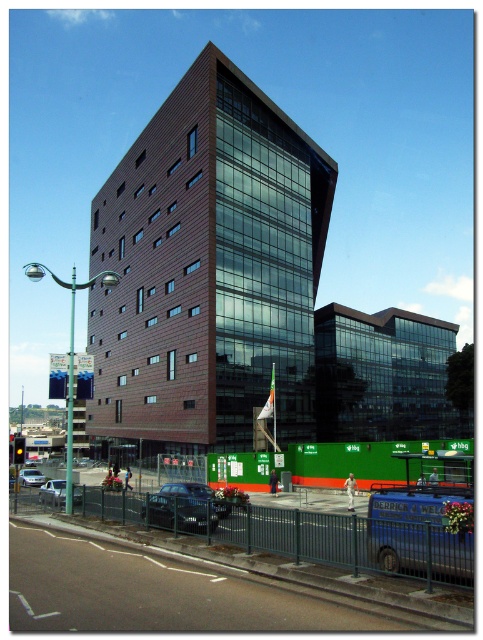
You are a delivery driver who needs to park your truck, which is 100 feet long, between the shiny black car at center and the silver metallic car at center. Is there enough space between them to park your truck?

The distance between the shiny black car at center and the silver metallic car at center is 92.00 feet, which is shorter than the truck length of 100 feet. Therefore, there is not enough space to park the truck between them.

You are a delivery driver who needs to park your vehicle in this area. You see a shiny black car at center and a silver metallic car at center. Which car is blocking the parking space more significantly?

The shiny black car at center is positioned over the silver metallic car at center, so it is blocking the parking space more significantly.

Looking at this image, you are a delivery driver who needs to park your 2.5 meter wide truck between the silver metallic car at lower left and the silver metallic car at center. Can you fit your truck there?

The distance between the silver metallic car at lower left and the silver metallic car at center is 6.40 meters. Since your truck is 2.5 meters wide, there is enough space to park between them as 6.40 meters is greater than 2.5 meters.